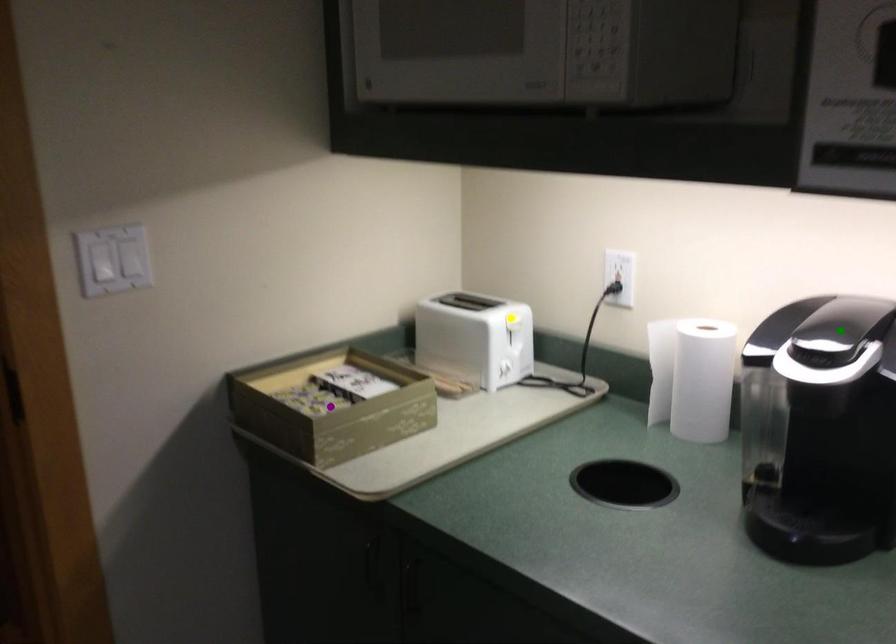
Order these from nearest to farthest:
1. green point
2. yellow point
3. purple point

yellow point → purple point → green point